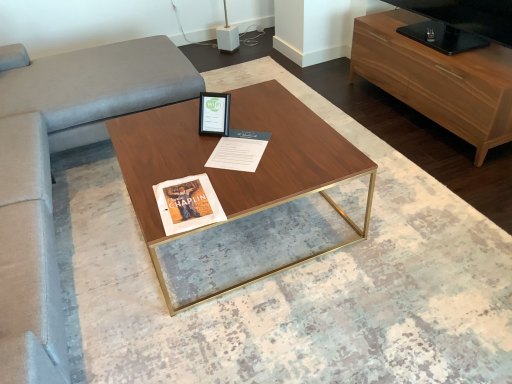
Find the location of `free space to the left of white paper at center`. free space to the left of white paper at center is located at coordinates (181, 150).